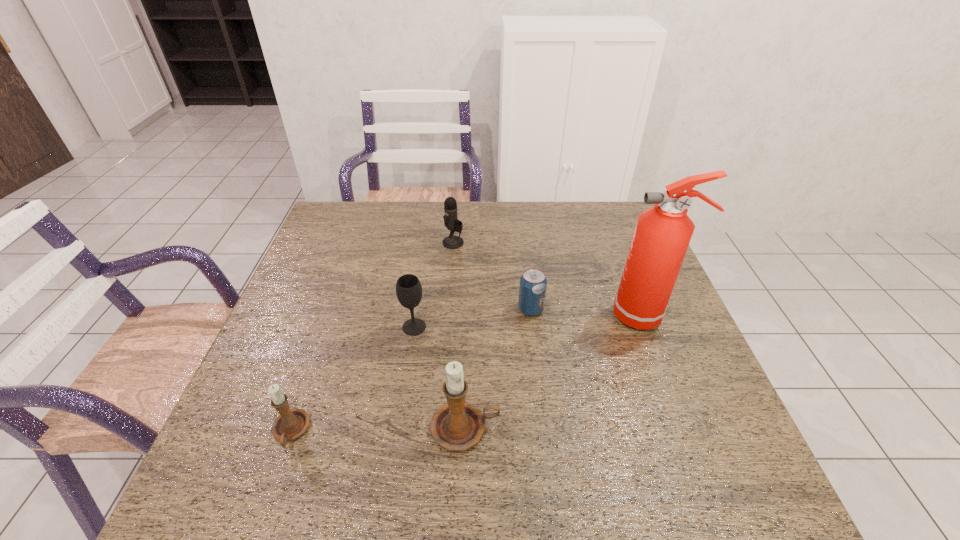
Please point out where to position a new candle holder on the right to maintain spacing. Please provide its 2D coordinates. Your answer should be formatted as a tuple, i.e. [(x, y)], where the tuple contains the x and y coordinates of a point satisfying the conditions above.

[(636, 426)]